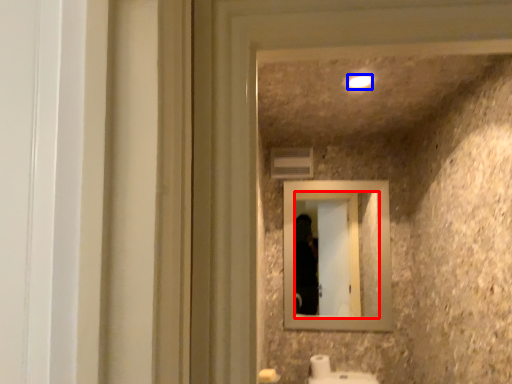
Question: Which object is closer to the camera taking this photo, mirror (highlighted by a red box) or light (highlighted by a blue box)?

Choices:
 (A) mirror
 (B) light

Answer: (B)